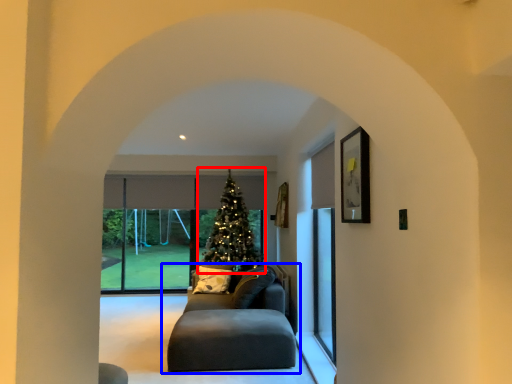
Question: Which of the following is the closest to the observer, christmas tree (highlighted by a red box) or studio couch (highlighted by a blue box)?

Choices:
 (A) christmas tree
 (B) studio couch

Answer: (B)